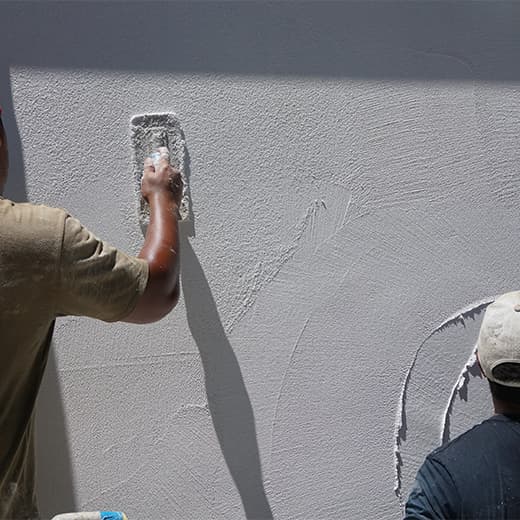
Image resolution: width=520 pixels, height=520 pixels. What are the coordinates of `excess paint on wall` in the screenshot? It's located at (471, 360), (450, 319), (268, 279), (181, 152).